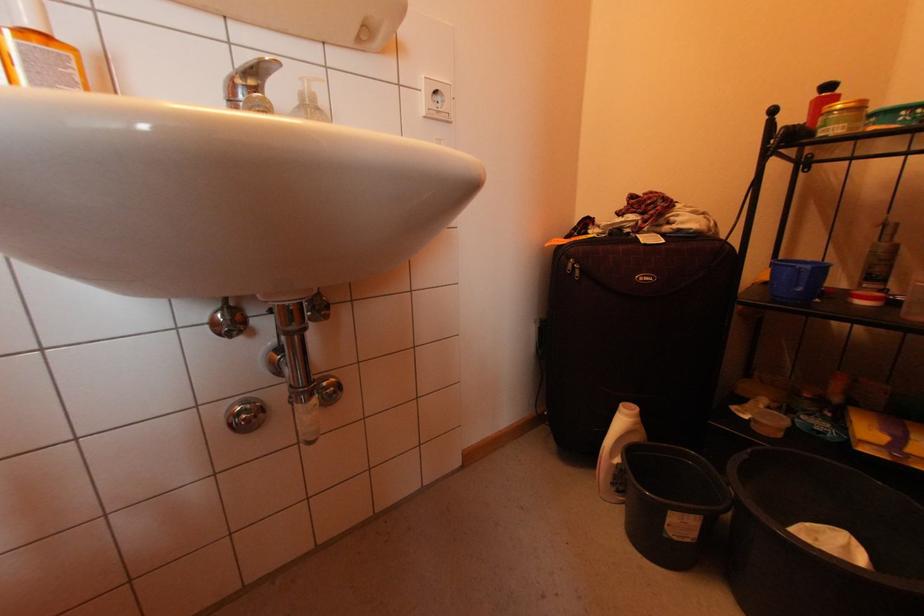
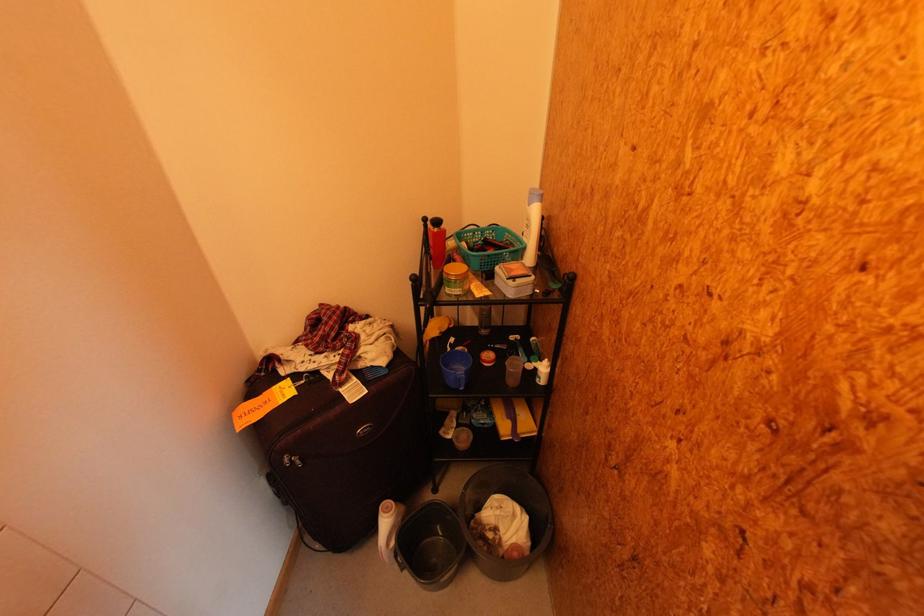
Where in the second image is the point corresponding to (x=616, y=456) from the first image?

(393, 546)